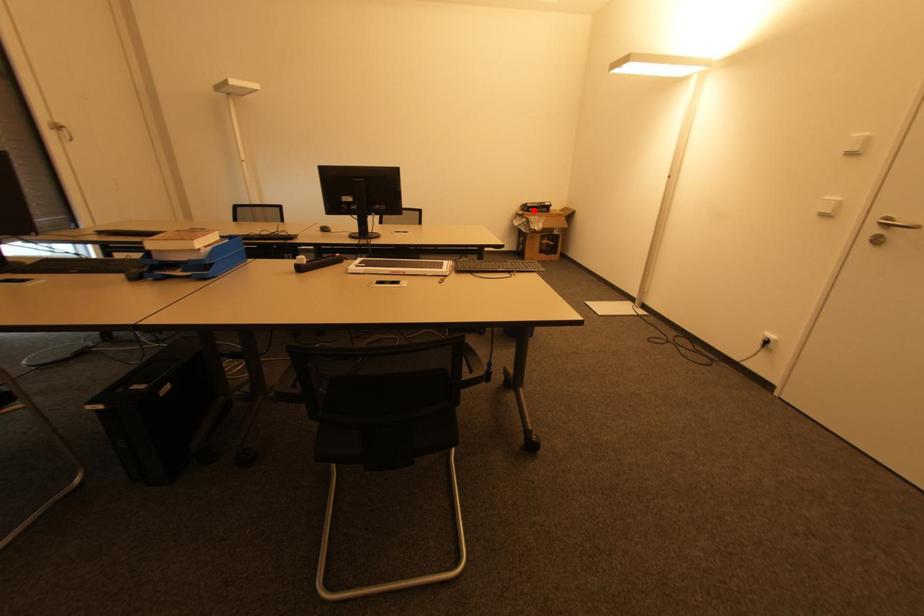
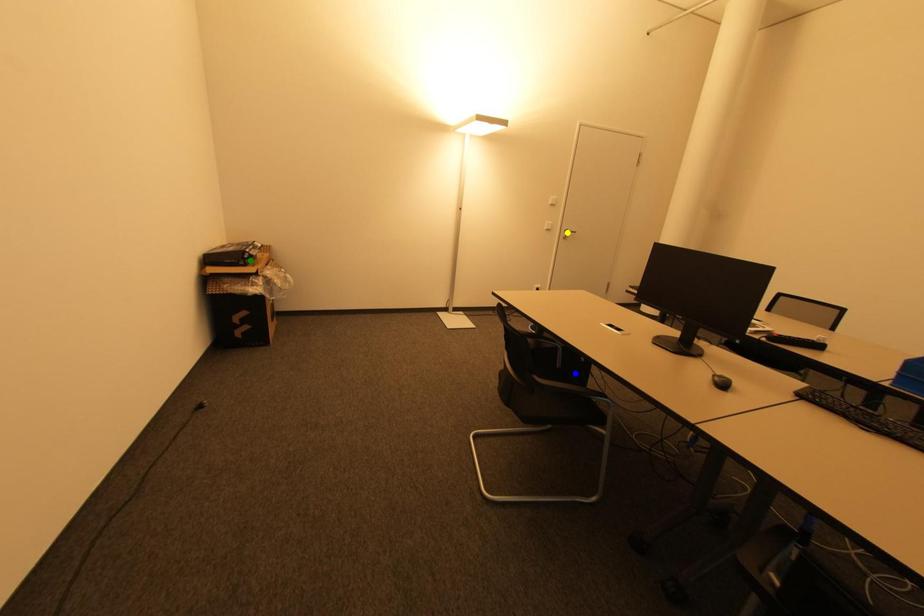
Question: I am providing you with two images of the same scene from different viewpoints. A red point is marked on the first image. You are given multiple points on the second image. Which mark in image 2 goes with the point in image 1?

Choices:
 (A) green point
 (B) yellow point
 (C) blue point

Answer: (A)